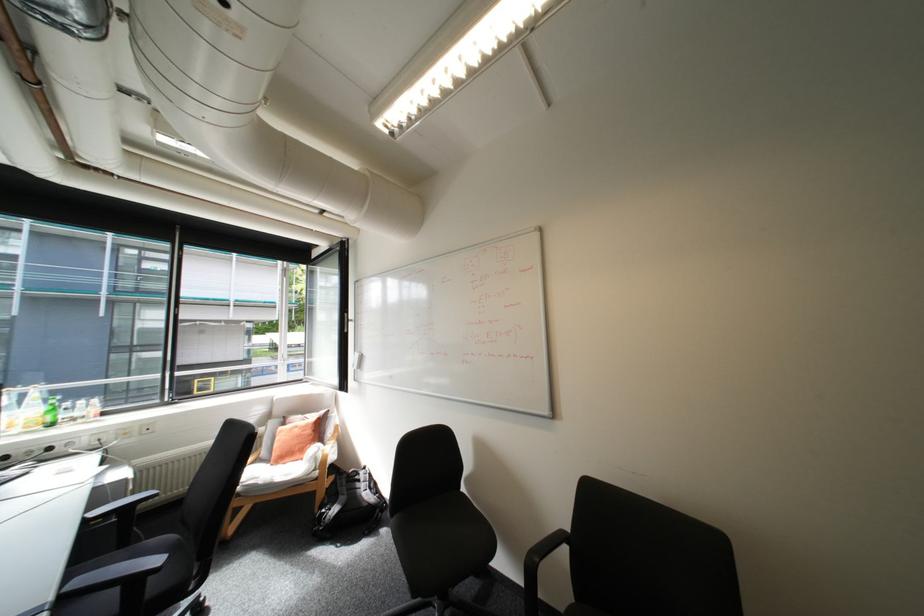
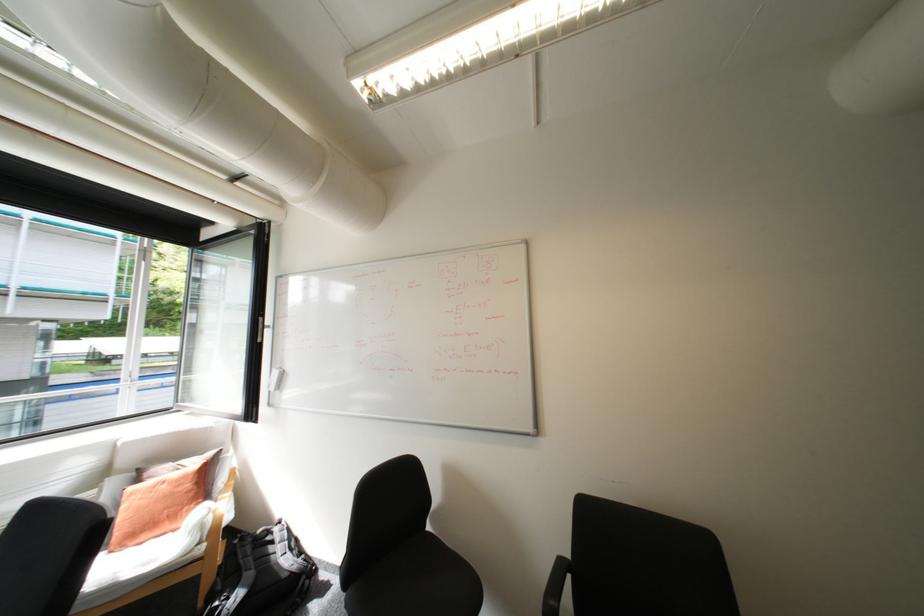
Where in the second image is the point corresponding to the point at 353,367 from the first image?

(261, 387)